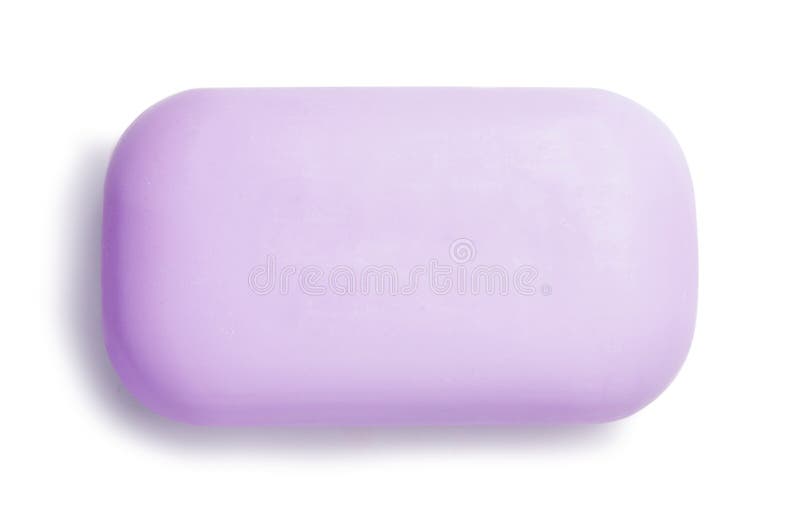
Where is `purple soap`? The image size is (800, 532). purple soap is located at coordinates [630, 320].